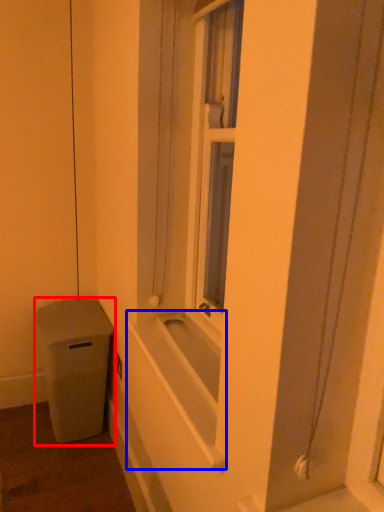
Question: Which object is further to the camera taking this photo, waste container (highlighted by a red box) or bath (highlighted by a blue box)?

Choices:
 (A) waste container
 (B) bath

Answer: (A)